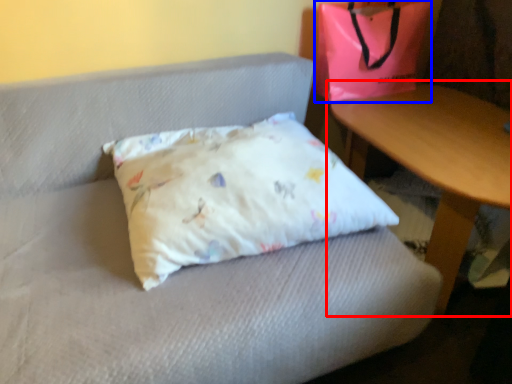
Question: Which object appears farthest to the camera in this image, table (highlighted by a red box) or pouch (highlighted by a blue box)?

Choices:
 (A) table
 (B) pouch

Answer: (B)